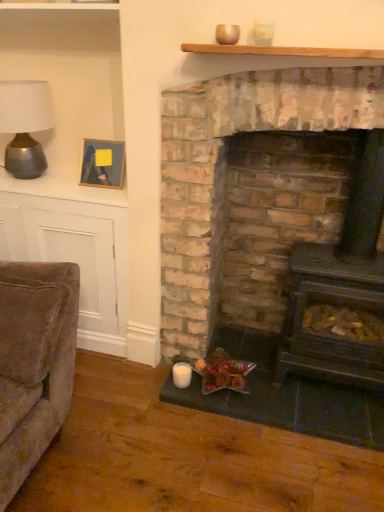
Identify the location of free space to the left of wooden picture frame at upper left. Image resolution: width=384 pixels, height=512 pixels. (59, 186).